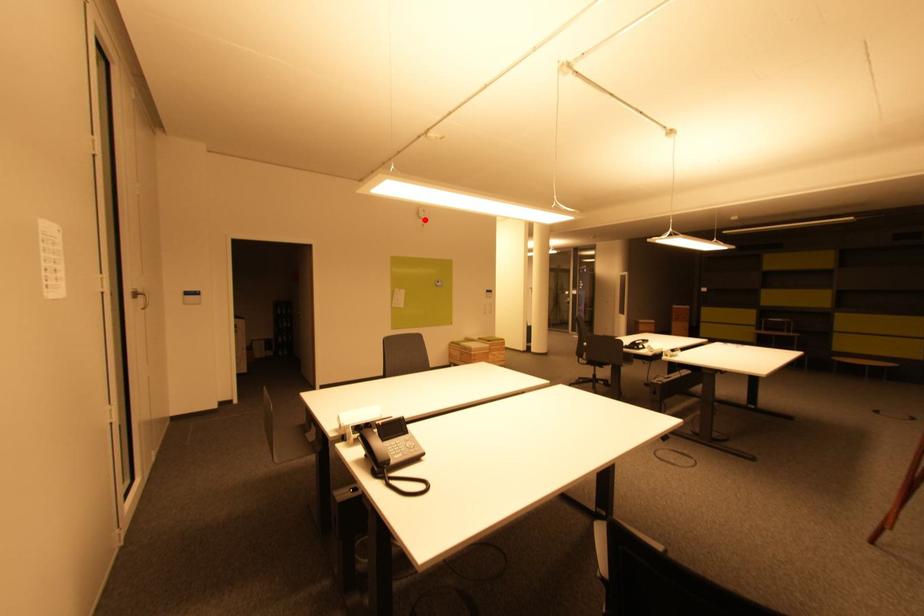
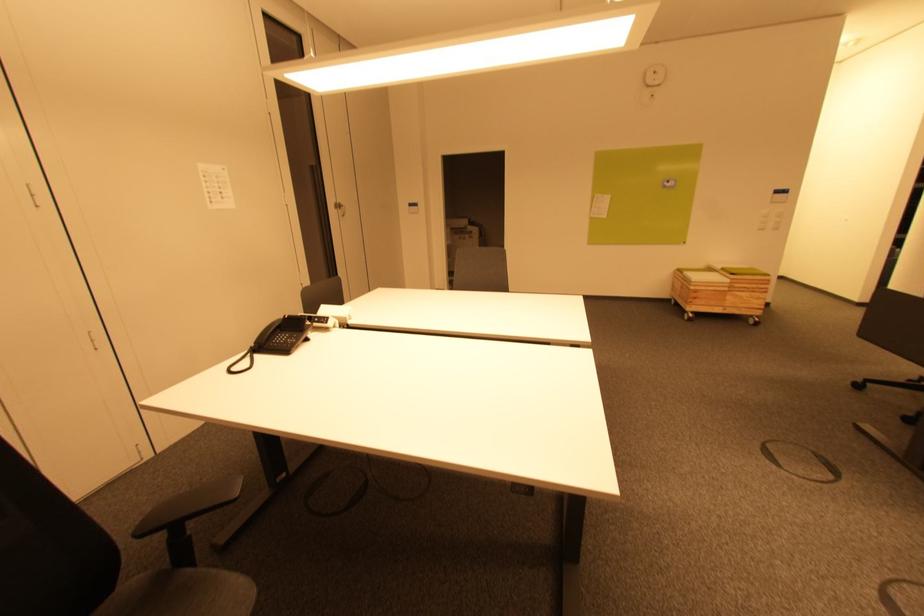
In the second image, find the point that corresponds to the highlighted location in the first image.

(652, 87)